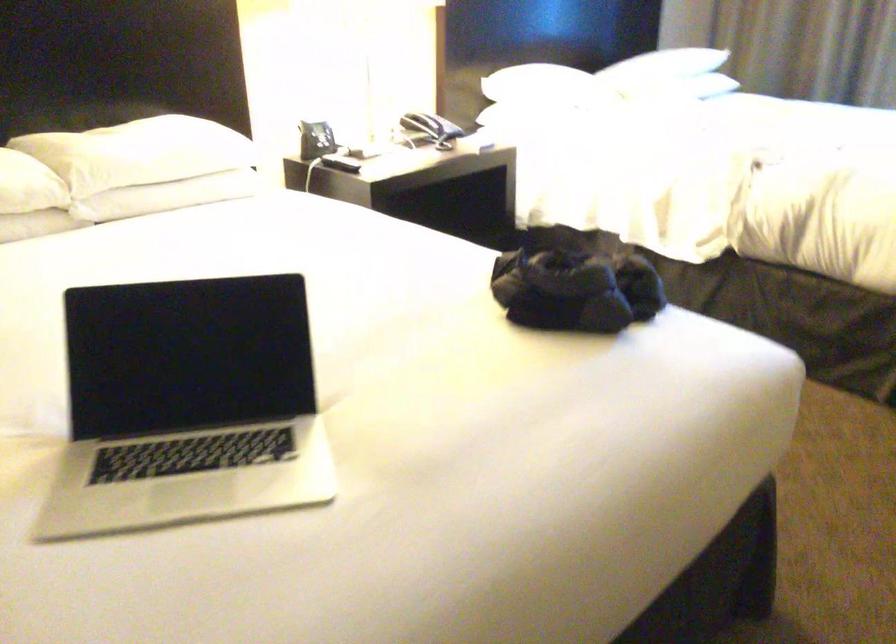
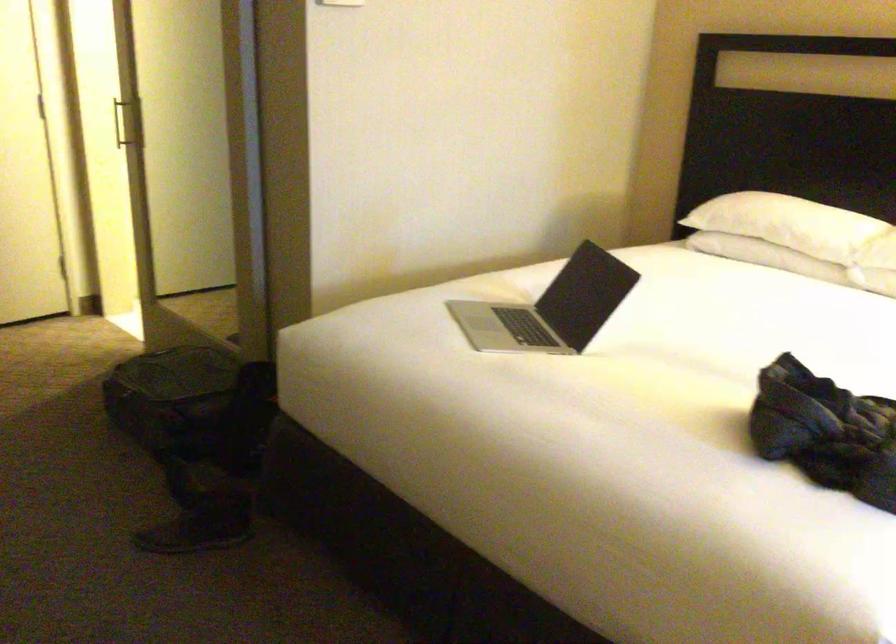
In the second image, find the point that corresponds to [599,294] in the first image.

(825, 431)